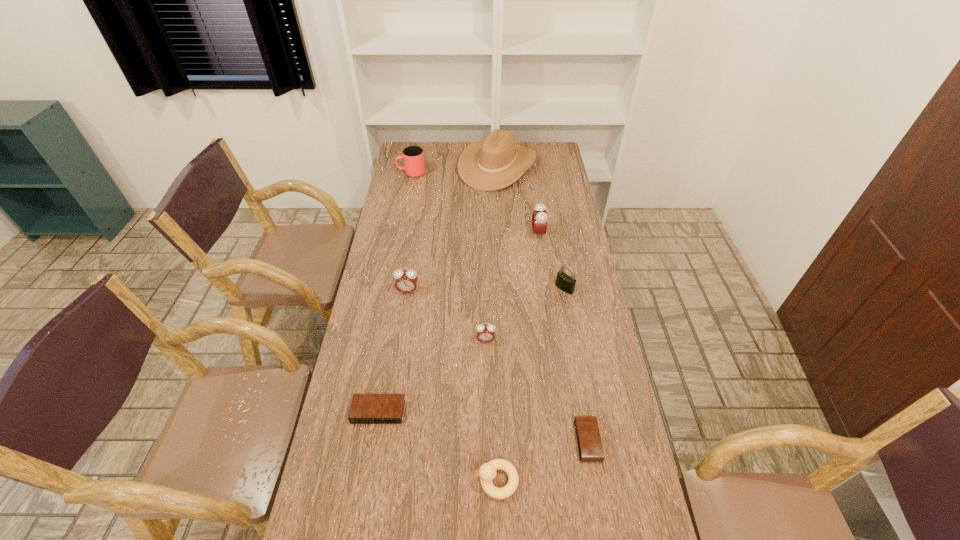
In order to click on cowboy hat present at the right edge in this screenshot , I will do `click(489, 164)`.

Locate an element on the screen. padlock located in the right edge section of the desktop is located at coordinates (566, 283).

Identify the location of object situated at the far right corner. (489, 164).

At what (x,y) coordinates should I click in order to perform the action: click on free point at the far edge. Please return your answer as a coordinate pair (x, y). This screenshot has height=540, width=960. Looking at the image, I should click on (442, 148).

Locate an element on the screen. The image size is (960, 540). vacant space at the left edge of the desktop is located at coordinates (343, 471).

Locate an element on the screen. This screenshot has width=960, height=540. vacant point at the right edge is located at coordinates (571, 317).

Where is `blank area at the far left corner`? This screenshot has width=960, height=540. blank area at the far left corner is located at coordinates (431, 143).

Locate an element on the screen. Image resolution: width=960 pixels, height=540 pixels. free space between the black padlock and the left black alarm clock is located at coordinates (471, 350).

Identify the location of free area in between the duckling and the black padlock. (531, 384).

This screenshot has height=540, width=960. I want to click on vacant region between the tallest alarm clock and the shortest alarm clock, so click(x=563, y=338).